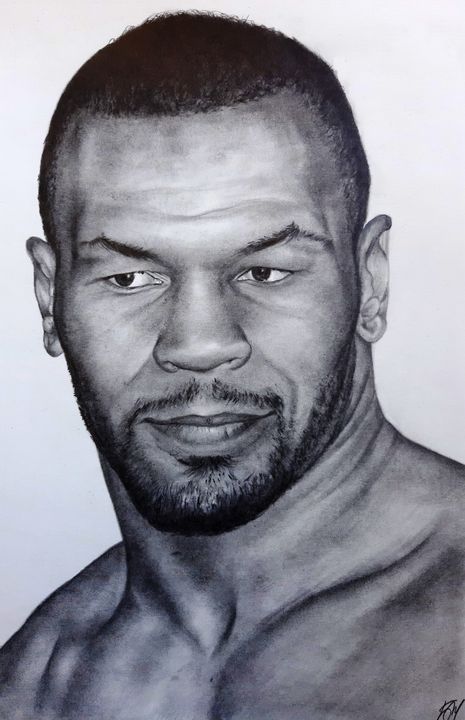
What are the coordinates of `chest` in the screenshot? It's located at (266, 670).